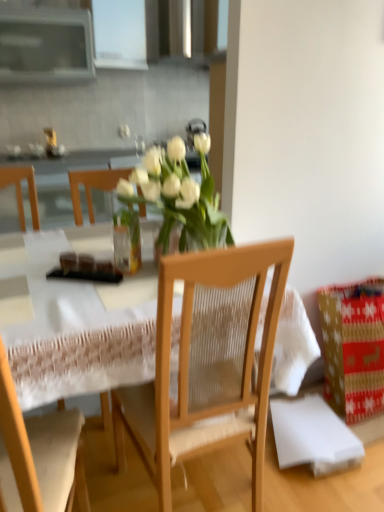
You are a GUI agent. You are given a task and a screenshot of the screen. Output one action in this format:
    pyautogui.click(x=<x>, y=<y>)
    Task: Click on the free space in front of transparent glass vase at center
    Image resolution: width=384 pixels, height=512 pixels.
    Given the screenshot: What is the action you would take?
    pyautogui.click(x=109, y=291)